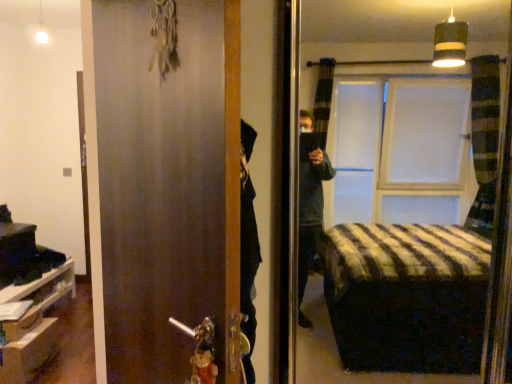
Question: Which is correct: matte brown door at center is inside white matte cabinet at lower left, or outside of it?

Choices:
 (A) inside
 (B) outside

Answer: (B)

Question: In the image, is matte brown door at center positioned in front of or behind white matte cabinet at lower left?

Choices:
 (A) behind
 (B) front

Answer: (B)

Question: Based on their relative distances, which object is farther from the white matte cabinet at lower left?

Choices:
 (A) matte brown door at center
 (B) wooden drawer at lower left

Answer: (A)

Question: Considering the real-world distances, which object is closest to the white matte cabinet at lower left?

Choices:
 (A) wooden drawer at lower left
 (B) matte brown door at center

Answer: (A)